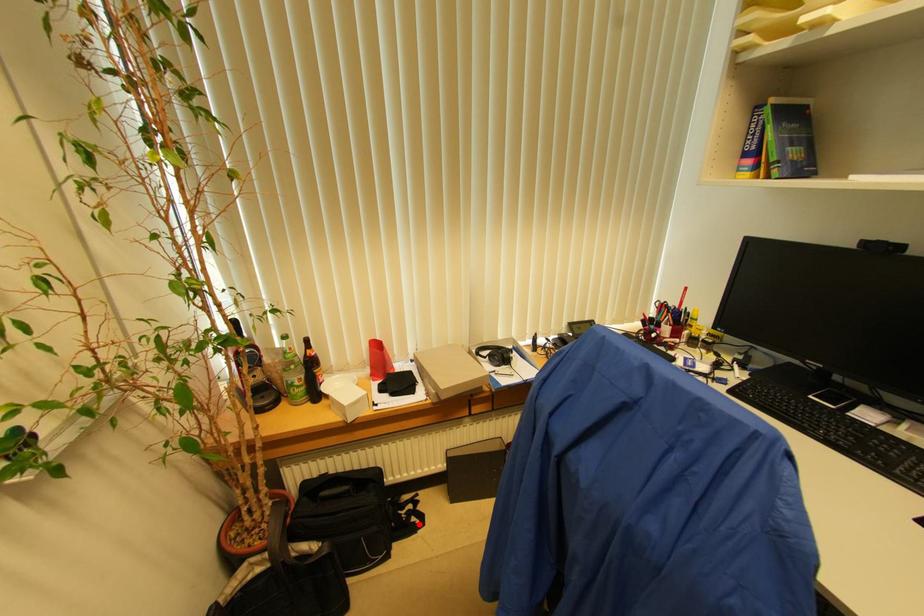
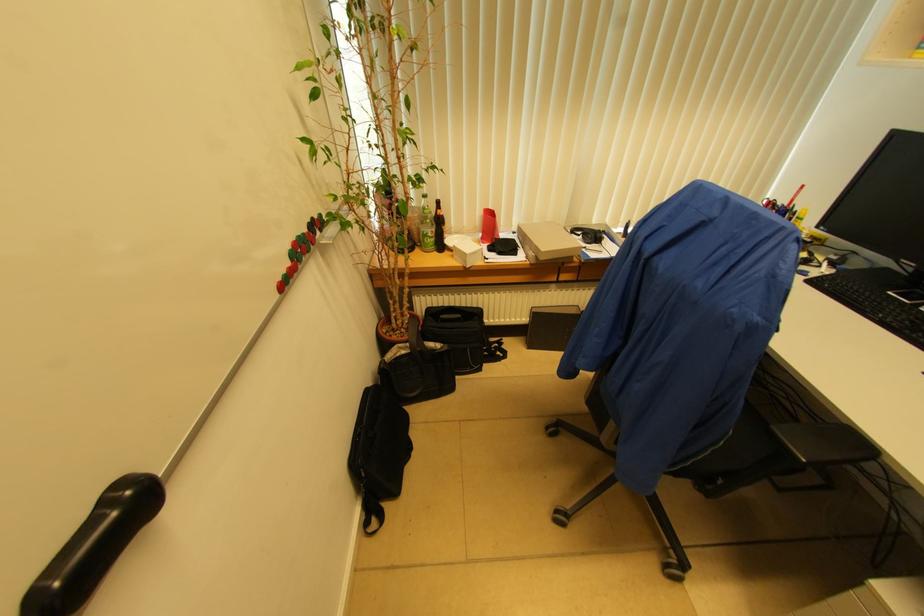
Where in the second image is the point corresponding to the highlighted location from the first image?

(503, 358)